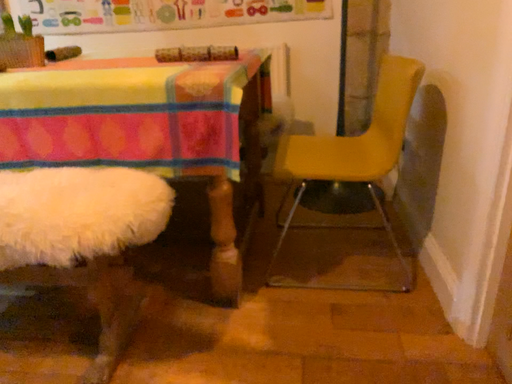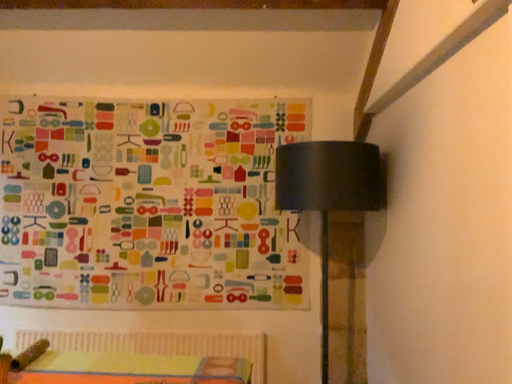
Question: Which way did the camera rotate in the video?

Choices:
 (A) rotated downward
 (B) rotated upward

Answer: (B)